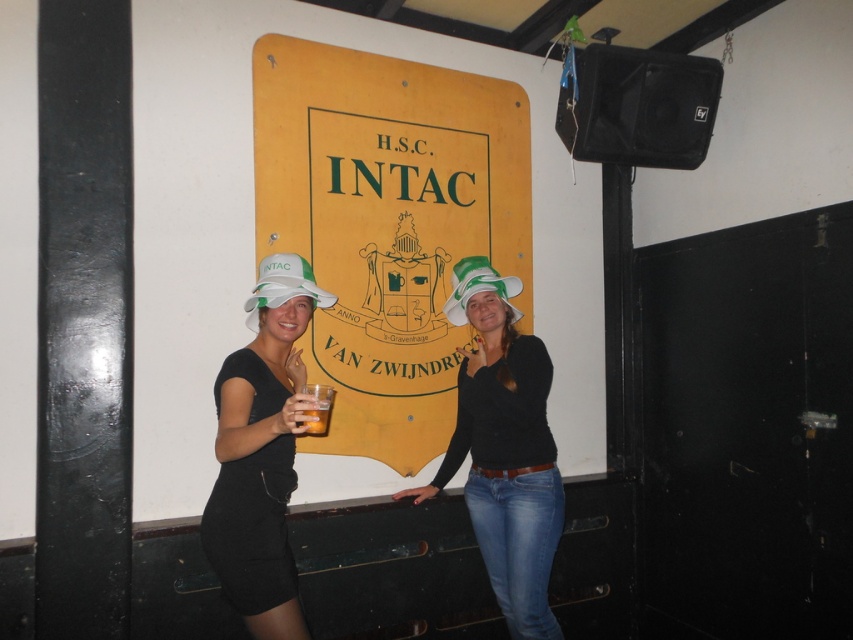
You are a photographer adjusting the camera focus. The matte white hat at center and the white fabric hat at left are both in the frame. Which hat should you focus on first if you want to ensure the larger one is sharp?

The matte white hat at center is larger than the white fabric hat at left, so you should focus on the matte white hat at center first to ensure it is sharp.